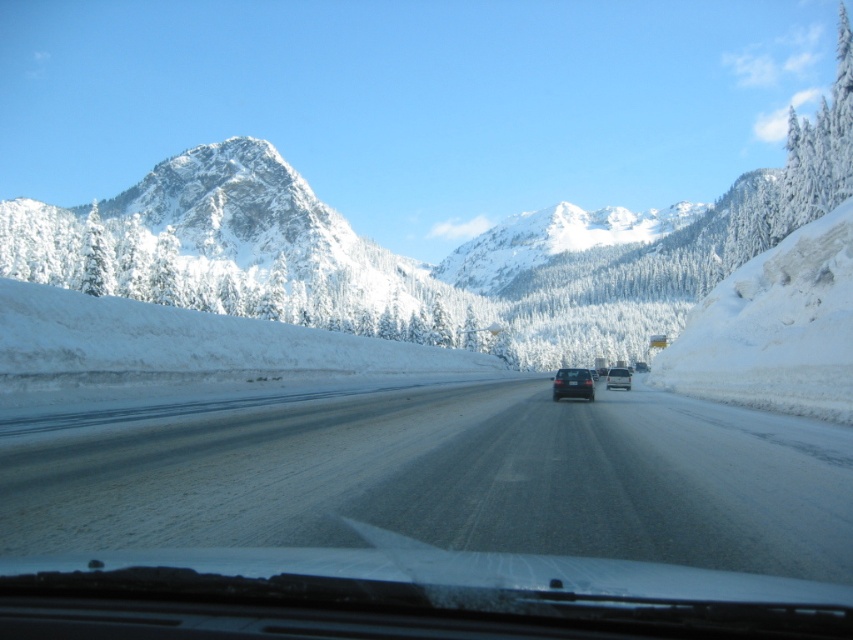
You are driving a car and see the point marked at coordinates (572, 384) in the image. What object does this point represent?

The point at coordinates (572, 384) corresponds to the satin black sedan at center.

You are driving a car and see the satin black sedan at center and the satin silver van at center ahead on the snowy road. Which vehicle is shorter in height?

The satin black sedan at center is not as tall as the satin silver van at center, so the satin black sedan at center is shorter in height.

You are driving a car with a 5.5 meter turning radius. You need to make a U turn on the smooth asphalt highway at center. Can you do it without crossing the snow covered embankments on both sides?

The smooth asphalt highway at center and viewer are 6.03 meters apart. Since the car requires a 5.5 meter turning radius, it can make the U turn without crossing the snow covered embankments on both sides as the available space is sufficient.